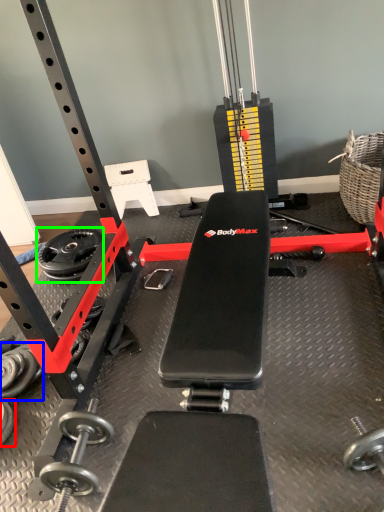
Question: Which is nearer to the dumbbell (highlighted by a red box)? dumbbell (highlighted by a blue box) or wheel (highlighted by a green box).

Choices:
 (A) dumbbell
 (B) wheel

Answer: (A)